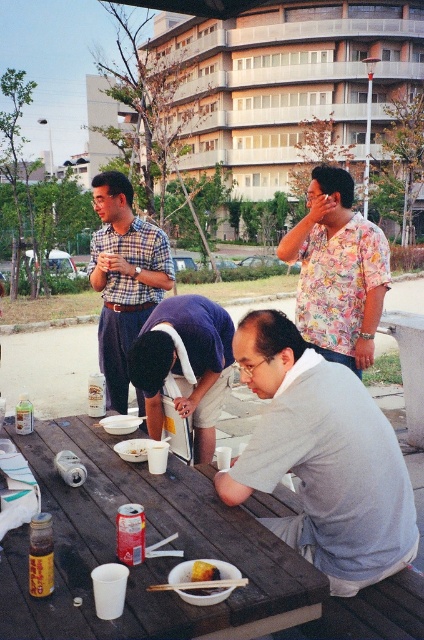
Question: Can you confirm if brown wooden table at center is thinner than plaid shirt at upper left?

Choices:
 (A) no
 (B) yes

Answer: (A)

Question: Among these objects, which one is nearest to the camera?

Choices:
 (A) brown crumbly cake at center
 (B) plaid shirt at upper left

Answer: (A)

Question: Which object is the closest to the plaid shirt at upper left?

Choices:
 (A) white paper bowl at table center
 (B) brown crumbly cake at center
 (C) brown wooden table at center
 (D) gray matte shirt at lower right

Answer: (A)

Question: Considering the relative positions of plaid shirt at upper left and white paper bowl at table center in the image provided, where is plaid shirt at upper left located with respect to white paper bowl at table center?

Choices:
 (A) below
 (B) above

Answer: (B)

Question: Does plaid shirt at upper left appear on the right side of brown crumbly cake at center?

Choices:
 (A) no
 (B) yes

Answer: (A)

Question: Which point is farther from the camera taking this photo?

Choices:
 (A) click(x=195, y=563)
 (B) click(x=211, y=496)

Answer: (B)